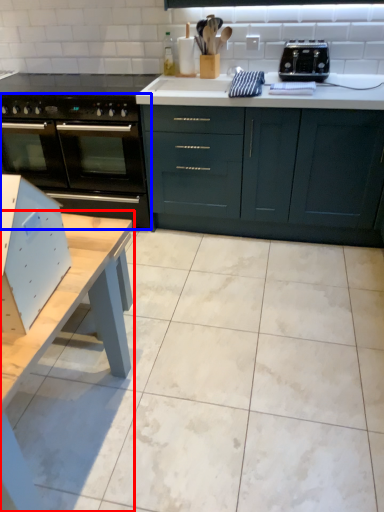
Question: Which point is further to the camera, table (highlighted by a red box) or oven (highlighted by a blue box)?

Choices:
 (A) table
 (B) oven

Answer: (B)